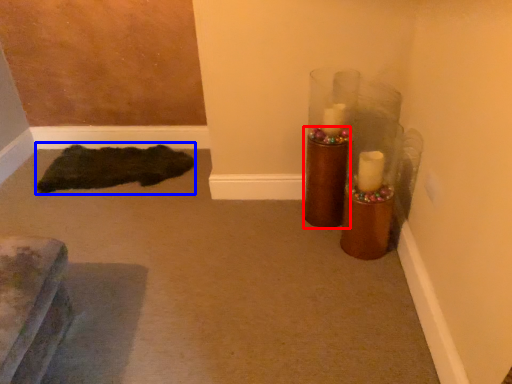
Question: Which point is closer to the camera, candle holder (highlighted by a red box) or doormat (highlighted by a blue box)?

Choices:
 (A) candle holder
 (B) doormat

Answer: (A)